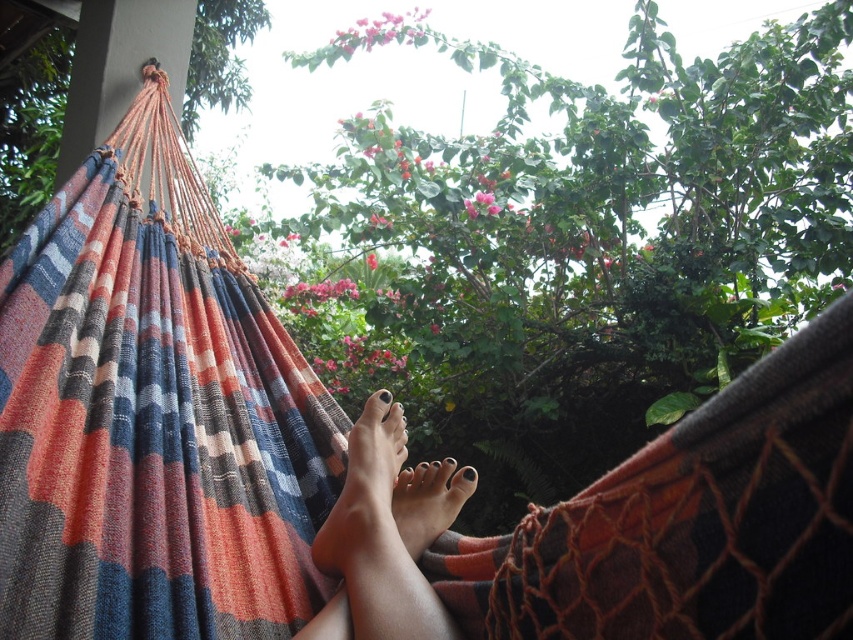
Question: Is nail polish toes at center further to the viewer compared to smooth skin foot at center?

Choices:
 (A) yes
 (B) no

Answer: (B)

Question: In this image, where is nail polish toes at center located relative to smooth skin foot at center?

Choices:
 (A) right
 (B) left

Answer: (A)

Question: Can you confirm if nail polish toes at center is smaller than smooth skin foot at center?

Choices:
 (A) no
 (B) yes

Answer: (A)

Question: Which point is farther to the camera?

Choices:
 (A) smooth skin foot at center
 (B) nail polish toes at center

Answer: (A)

Question: Among these points, which one is nearest to the camera?

Choices:
 (A) (321, 538)
 (B) (349, 550)

Answer: (B)